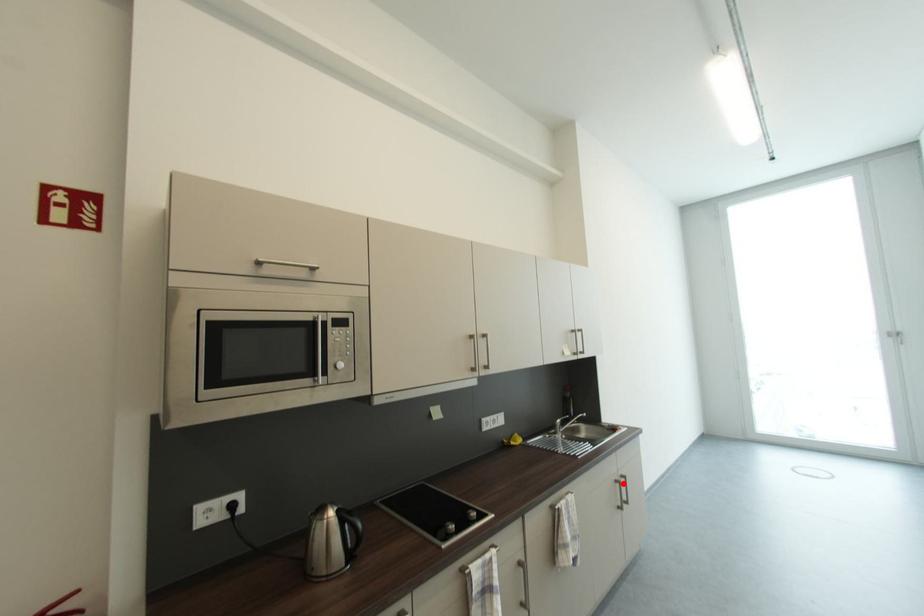
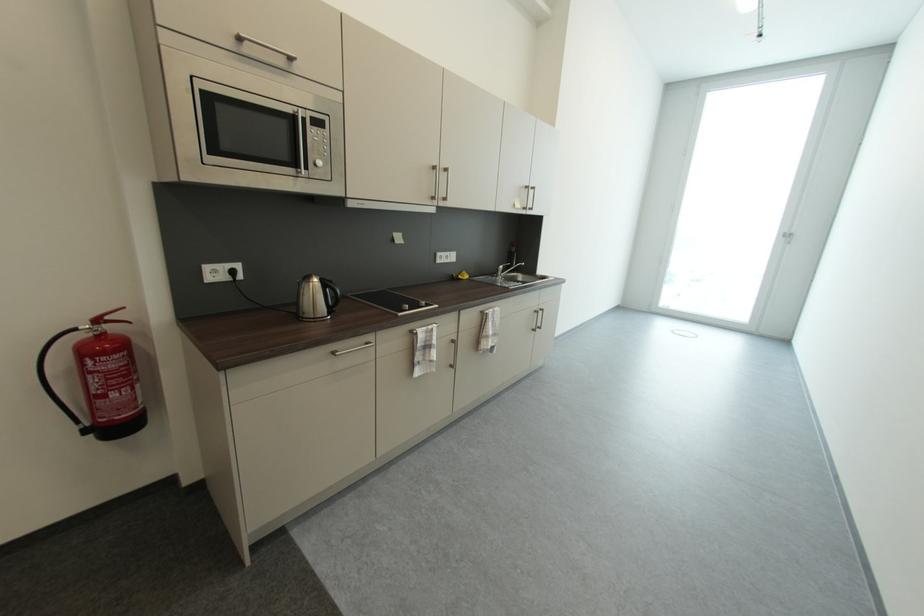
Question: I am providing you with two images of the same scene from different viewpoints. Image1 has a red point marked. In image2, the corresponding 3D location appears at what relative position? Reply with the corresponding letter.

Choices:
 (A) Closer
 (B) Farther

Answer: (A)